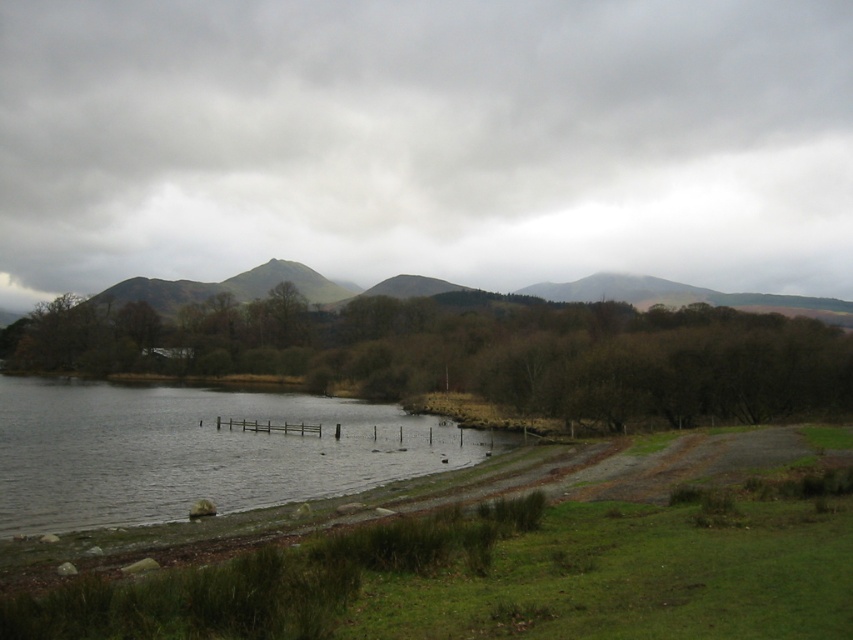
Can you confirm if grayish water at lower left is taller than green mossy hill at upper center?

No, grayish water at lower left is not taller than green mossy hill at upper center.

Which is in front, point (230, 467) or point (662, 285)?

Point (230, 467) is more forward.

This screenshot has width=853, height=640. What do you see at coordinates (198, 451) in the screenshot?
I see `grayish water at lower left` at bounding box center [198, 451].

I want to click on grayish water at lower left, so click(198, 451).